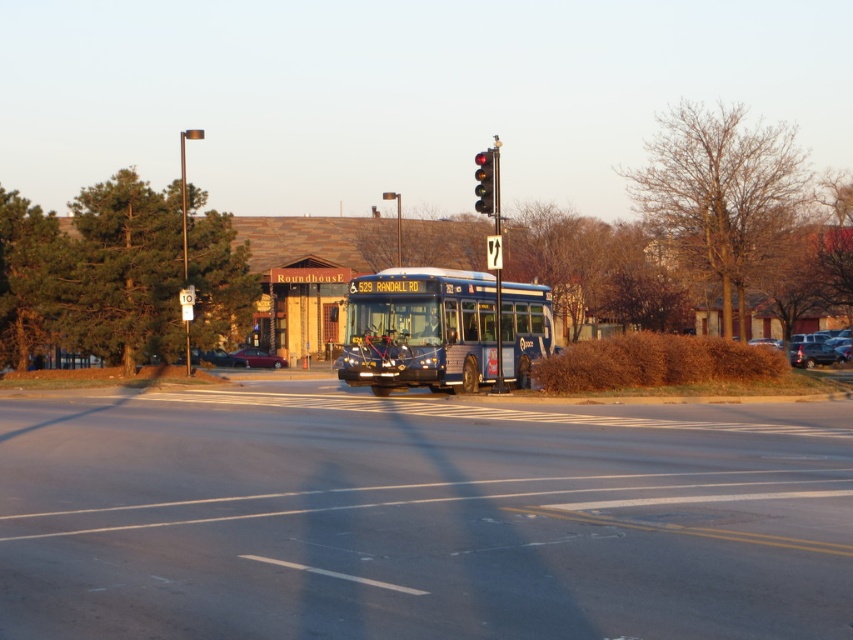
Question: Which of the following is the farthest from the observer?

Choices:
 (A) matte black suv at right
 (B) red glass traffic light at upper center

Answer: (A)

Question: Does matte black suv at right have a larger size compared to metallic silver sedan at center?

Choices:
 (A) yes
 (B) no

Answer: (A)

Question: Does blue metallic bus at center appear over red glass traffic light at upper center?

Choices:
 (A) yes
 (B) no

Answer: (B)

Question: Can you confirm if wooden sign at center is wider than matte black suv at right?

Choices:
 (A) no
 (B) yes

Answer: (A)

Question: Which is nearer to the metallic silver sedan at center-right?

Choices:
 (A) metallic red car at center
 (B) wooden sign at center

Answer: (B)

Question: Which is farther from the metallic red car at center?

Choices:
 (A) metallic silver sedan at center
 (B) matte black suv at right

Answer: (B)